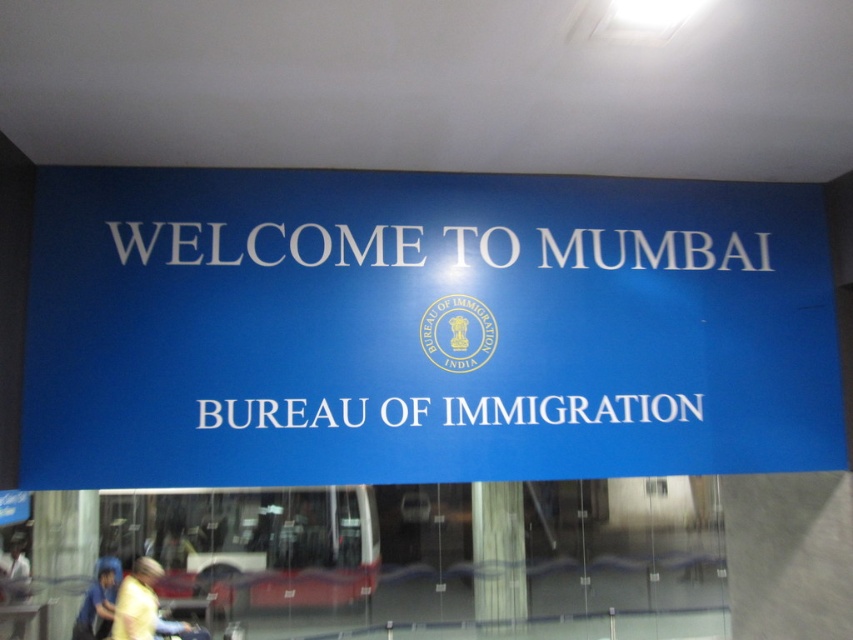
Is point (479, 253) more distant than point (320, 403)?

Yes.

In the scene shown: Which of these two, blue matte signboard at center or white plastic text at center, stands shorter?

With less height is white plastic text at center.

Between point (792, 260) and point (288, 412), which one is positioned in front?

Point (288, 412) is in front.

Locate an element on the screen. Image resolution: width=853 pixels, height=640 pixels. blue matte signboard at center is located at coordinates (422, 328).

Does blue matte signboard at center have a smaller size compared to yellow fabric shirt at lower left?

Actually, blue matte signboard at center might be larger than yellow fabric shirt at lower left.

Describe the element at coordinates (422, 328) in the screenshot. I see `blue matte signboard at center` at that location.

Who is more forward, (x=67, y=170) or (x=137, y=561)?

Point (x=67, y=170) is in front.

At what (x,y) coordinates should I click in order to perform the action: click on blue matte signboard at center. Please return your answer as a coordinate pair (x, y). Looking at the image, I should click on (422, 328).

Can you confirm if white matte text at upper center is wider than blue fabric at lower left?

Indeed, white matte text at upper center has a greater width compared to blue fabric at lower left.

Is point (390, 228) more distant than point (88, 620)?

That is False.

Which is in front, point (583, 266) or point (100, 576)?

Point (583, 266) is more forward.

Identify the location of white matte text at upper center. (268, 244).